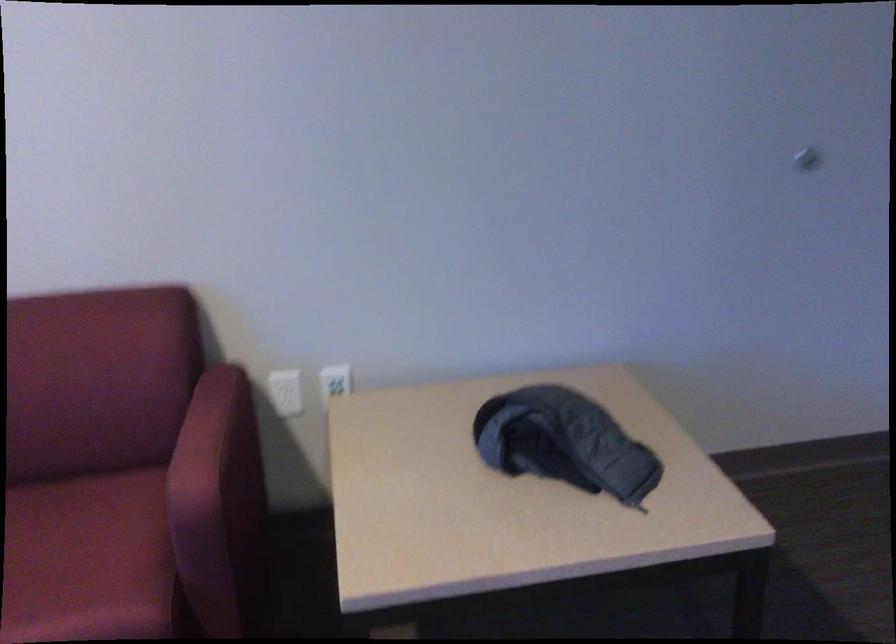
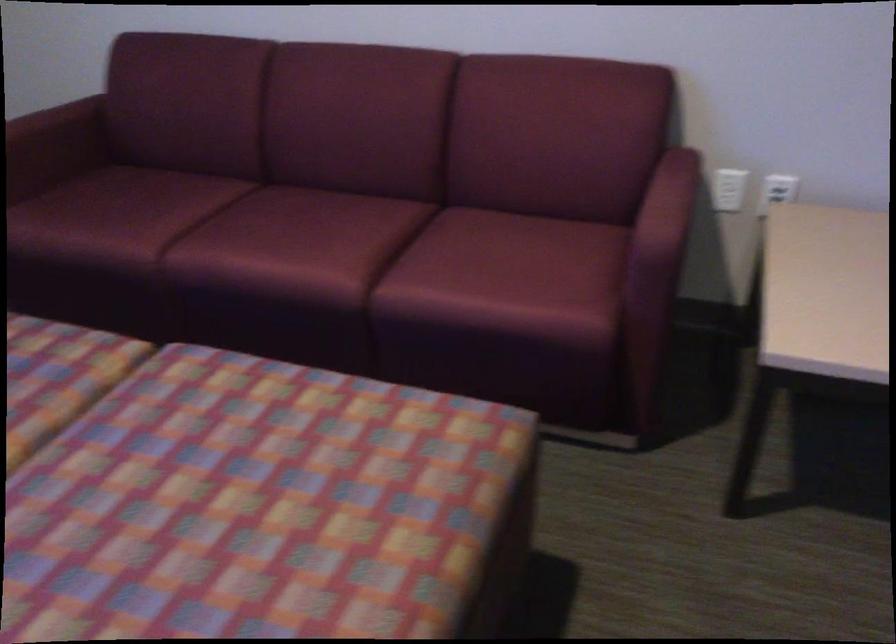
Locate, in the second image, the point that corresponds to point 340,381 in the first image.

(777, 190)